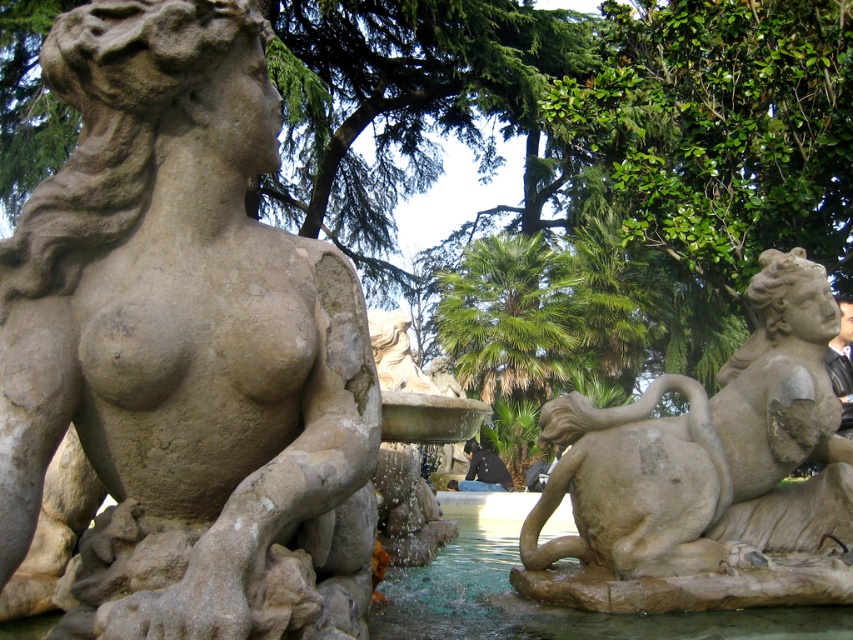
Is the position of matte stone lioness at right less distant than that of clear water at fountain center?

No, matte stone lioness at right is further to the viewer.

Who is taller, matte stone lioness at right or clear water at fountain center?

matte stone lioness at right is taller.

Is point (668, 460) positioned after point (485, 605)?

No, (668, 460) is closer to viewer.

At what (x,y) coordinates should I click in order to perform the action: click on matte stone lioness at right. Please return your answer as a coordinate pair (x, y). The width and height of the screenshot is (853, 640). Looking at the image, I should click on (706, 476).

Which is below, matte stone statue at left or clear water at fountain center?

clear water at fountain center is below.

Does point (253, 268) lie behind point (511, 540)?

That is False.

Does point (229, 154) come in front of point (677, 612)?

Yes.

The image size is (853, 640). Find the location of `matte stone statue at left`. matte stone statue at left is located at coordinates (184, 346).

Which is behind, point (151, 195) or point (844, 586)?

The point (844, 586) is more distant.

Does matte stone statue at left have a greater height compared to matte stone lioness at right?

Yes, matte stone statue at left is taller than matte stone lioness at right.

This screenshot has height=640, width=853. What are the coordinates of `matte stone statue at left` in the screenshot? It's located at (184, 346).

This screenshot has width=853, height=640. I want to click on matte stone statue at left, so click(x=184, y=346).